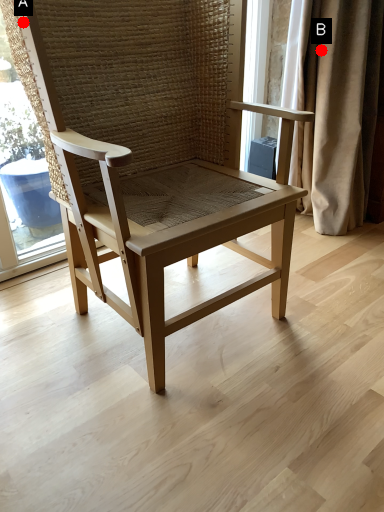
Question: Two points are circled on the image, labeled by A and B beside each circle. Which of the following is the farthest from the observer?

Choices:
 (A) A is further
 (B) B is further

Answer: (B)